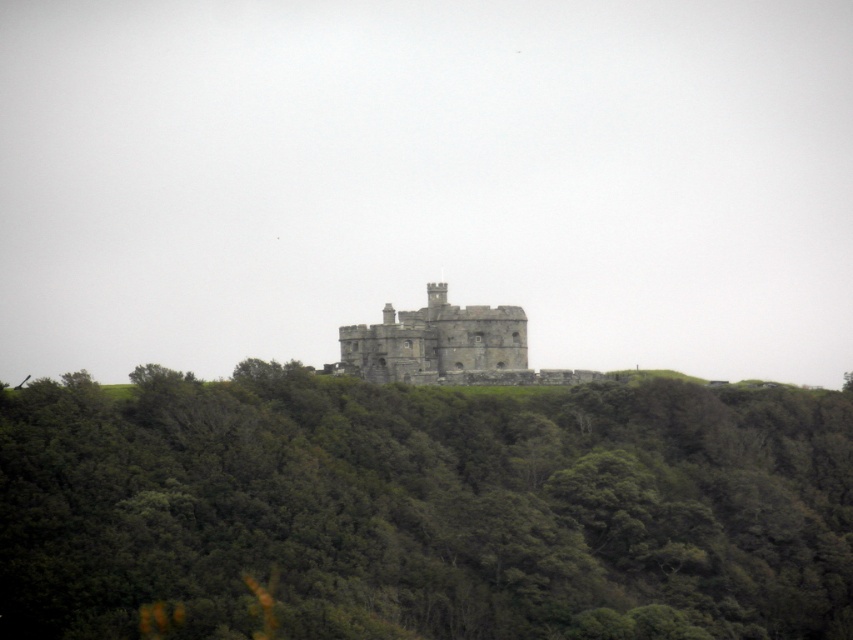
Question: Which point is closer to the camera taking this photo?

Choices:
 (A) (474, 330)
 (B) (454, 468)

Answer: (B)

Question: Is the position of green leafy tree at center more distant than that of stone castle at center?

Choices:
 (A) no
 (B) yes

Answer: (A)

Question: Can you confirm if green leafy tree at center is positioned below stone castle at center?

Choices:
 (A) no
 (B) yes

Answer: (B)

Question: Is green leafy tree at center bigger than stone castle at center?

Choices:
 (A) yes
 (B) no

Answer: (A)

Question: Which of the following is the closest to the observer?

Choices:
 (A) stone castle at center
 (B) green leafy tree at center

Answer: (B)